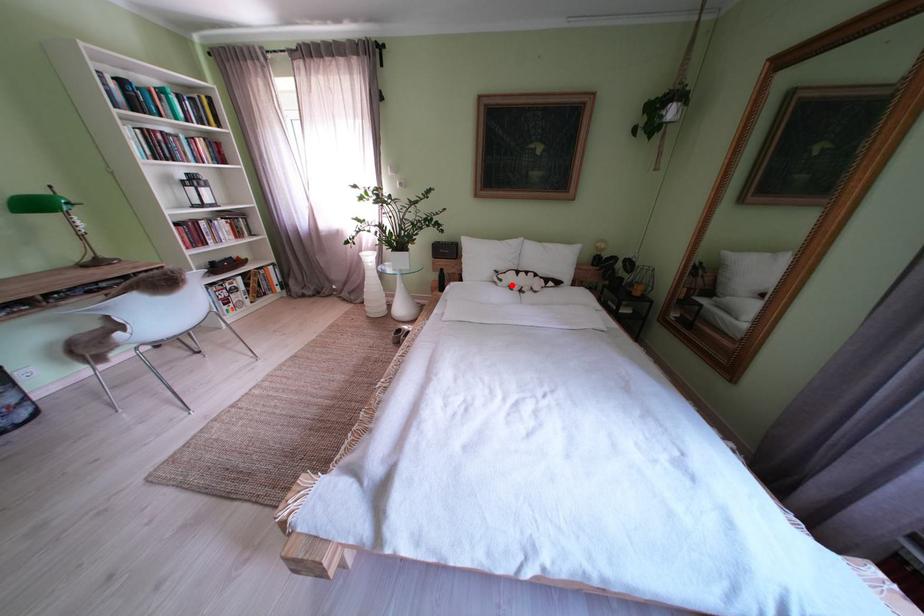
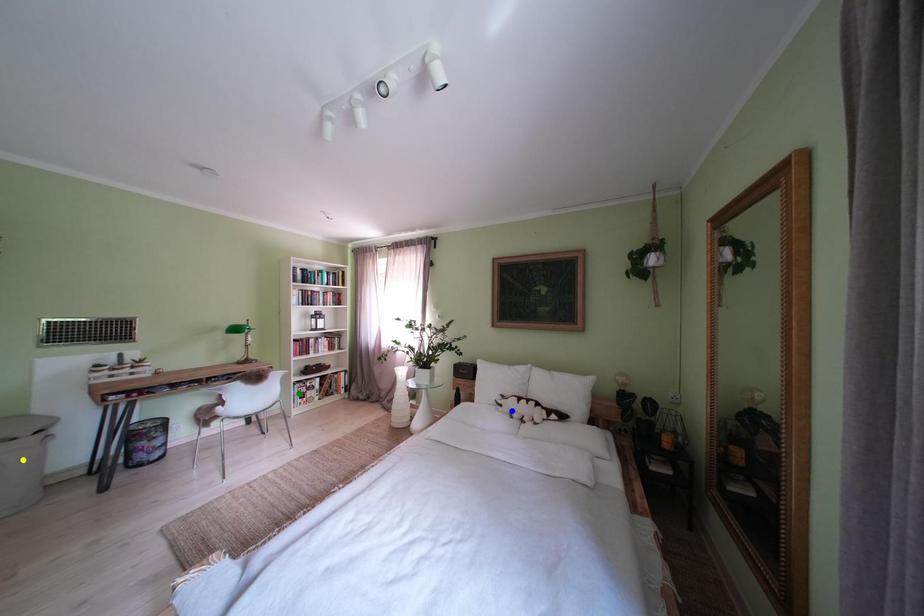
Question: I am providing you with two images of the same scene from different viewpoints. A red point is marked on the first image. You are given multiple points on the second image. Which point in image 2 is actually the same real-world point as the red point in image 1?

Choices:
 (A) blue point
 (B) green point
 (C) yellow point

Answer: (A)